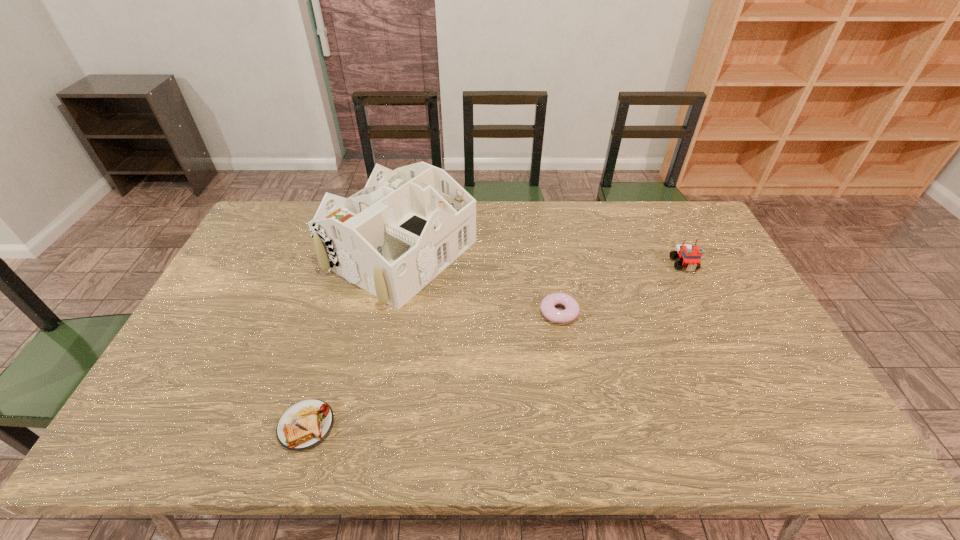
Where is `free spot between the dollhouse and the second tallest object`? This screenshot has width=960, height=540. free spot between the dollhouse and the second tallest object is located at coordinates (542, 259).

Locate an element on the screen. The width and height of the screenshot is (960, 540). free point between the Lego and the third object from left to right is located at coordinates (621, 288).

At what (x,y) coordinates should I click in order to perform the action: click on empty location between the doughnut and the dollhouse. Please return your answer as a coordinate pair (x, y). Looking at the image, I should click on (480, 283).

Identify the location of free space that is in between the nearest object and the tallest object. Image resolution: width=960 pixels, height=540 pixels. (353, 340).

Find the location of a particular element. free space between the third shortest object and the dollhouse is located at coordinates (542, 259).

Locate an element on the screen. This screenshot has width=960, height=540. vacant region between the shortest object and the third object from left to right is located at coordinates (433, 369).

You are a GUI agent. You are given a task and a screenshot of the screen. Output one action in this format:
    pyautogui.click(x=<x>, y=<y>)
    Task: Click on the free space that is in between the nearest object and the second tallest object
    
    Given the screenshot: What is the action you would take?
    pyautogui.click(x=495, y=345)

Where is `vacant area that lies between the tallest object and the third shortest object`? The height and width of the screenshot is (540, 960). vacant area that lies between the tallest object and the third shortest object is located at coordinates (542, 259).

The image size is (960, 540). Identify the location of free spot between the tallest object and the Lego. (542, 259).

Select which object appears as the second closest to the shortest object. Please provide its 2D coordinates. Your answer should be formatted as a tuple, i.e. [(x, y)], where the tuple contains the x and y coordinates of a point satisfying the conditions above.

[(547, 307)]